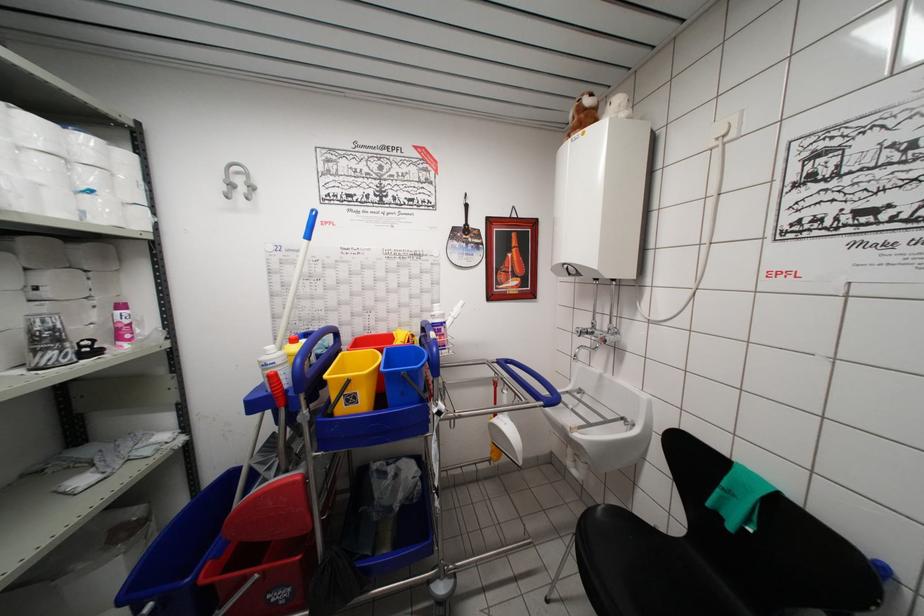
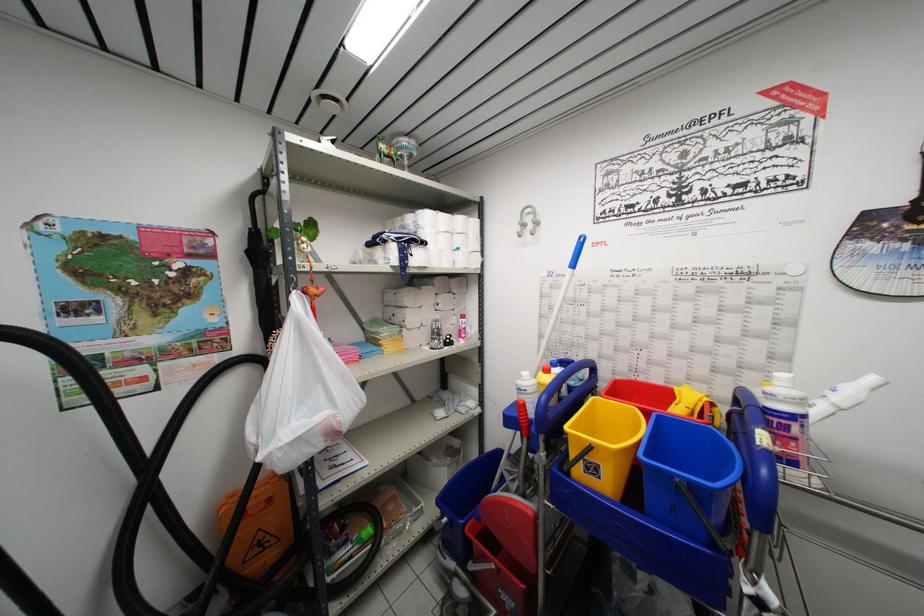
The point at (441, 333) is marked in the first image. Where is the corresponding point in the second image?

(783, 428)